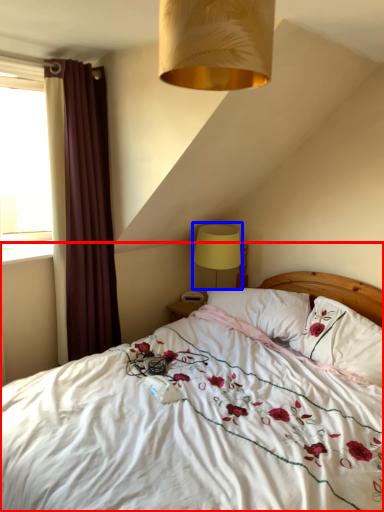
Question: Among these objects, which one is nearest to the camera, bed (highlighted by a red box) or table lamp (highlighted by a blue box)?

Choices:
 (A) bed
 (B) table lamp

Answer: (A)